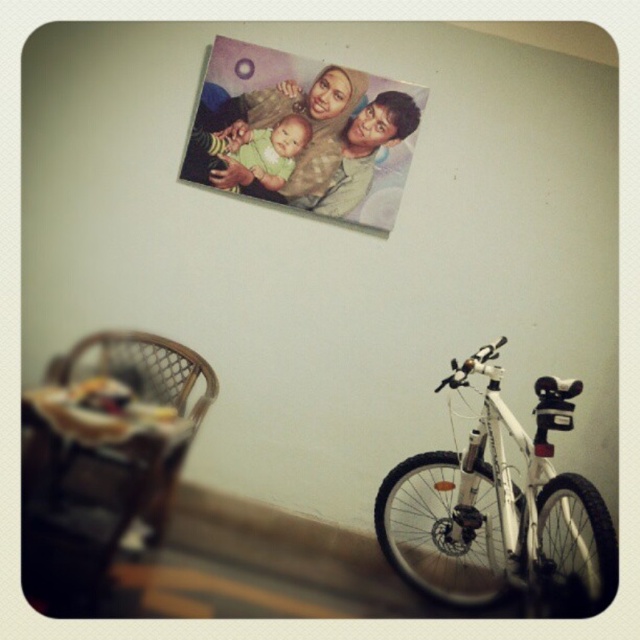
Question: Among these objects, which one is nearest to the camera?

Choices:
 (A) matte plastic photo at upper center
 (B) wooden highchair at lower left

Answer: (B)

Question: Is wooden highchair at lower left bigger than woven rattan chair at lower left?

Choices:
 (A) yes
 (B) no

Answer: (A)

Question: Which object is farther from the camera taking this photo?

Choices:
 (A) white matte bicycle at lower right
 (B) green fabric baby at upper center

Answer: (B)

Question: Based on their relative distances, which object is farther from the wooden highchair at lower left?

Choices:
 (A) white matte bicycle at lower right
 (B) green fabric baby at upper center
 (C) woven rattan chair at lower left
 (D) matte plastic photo at upper center

Answer: (A)

Question: Does wooden highchair at lower left appear over woven rattan chair at lower left?

Choices:
 (A) yes
 (B) no

Answer: (B)

Question: Is matte plastic photo at upper center below green fabric baby at upper center?

Choices:
 (A) no
 (B) yes

Answer: (A)